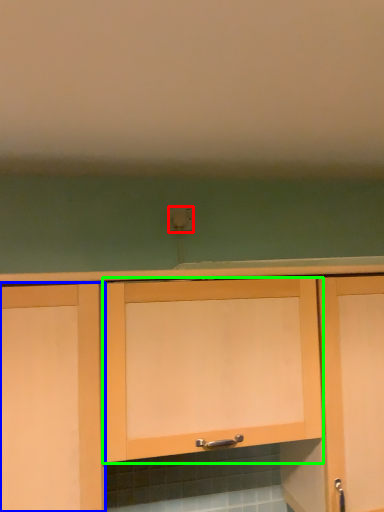
Question: Considering the real-world distances, which object is closest to electric outlet (highlighted by a red box)? cabinetry (highlighted by a blue box) or cabinetry (highlighted by a green box).

Choices:
 (A) cabinetry
 (B) cabinetry

Answer: (B)